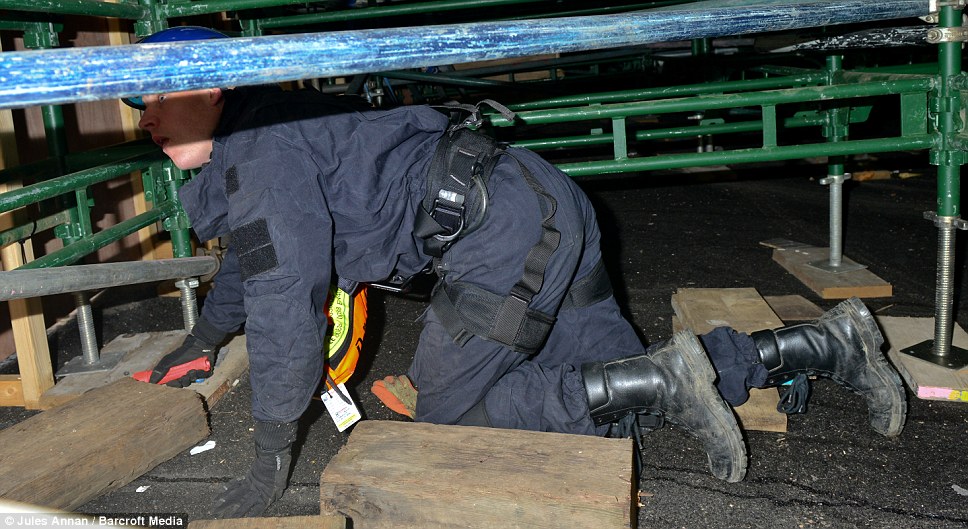
Identify the location of wooden blocks. (166, 416).